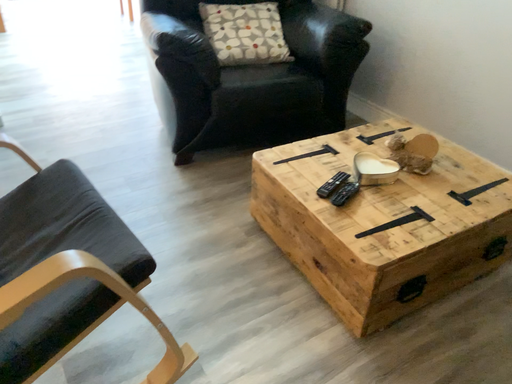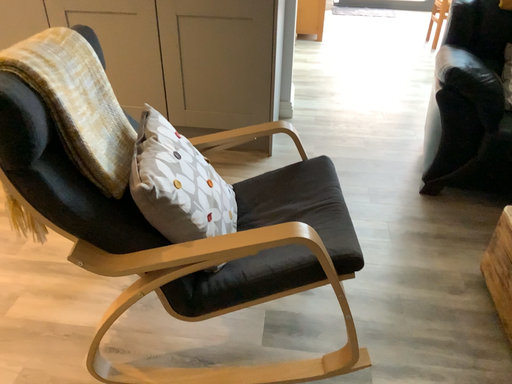
Question: Which way did the camera rotate in the video?

Choices:
 (A) rotated left
 (B) rotated right

Answer: (A)